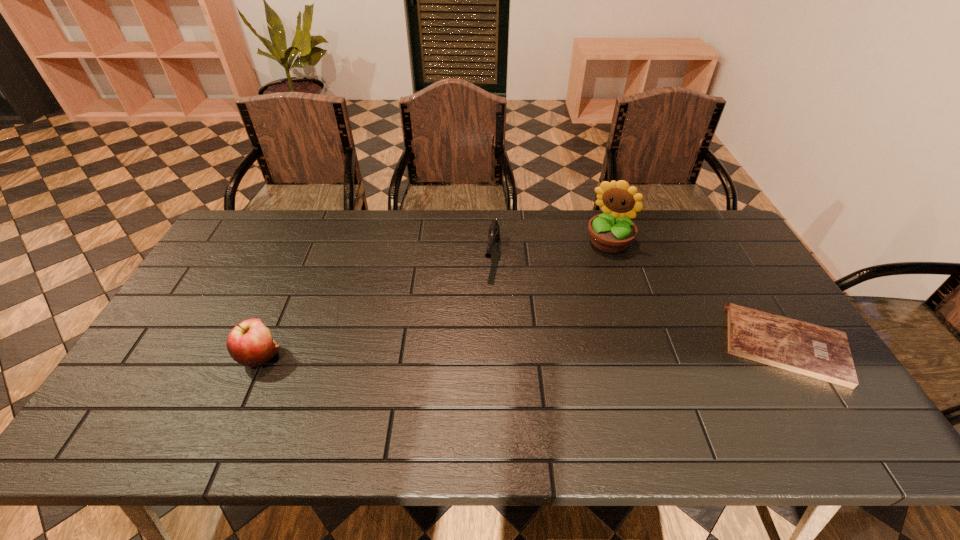
The image size is (960, 540). I want to click on vacant space that is in between the third object from left to right and the second object from left to right, so click(x=551, y=249).

I want to click on vacant region between the third object from left to right and the rightmost object, so click(697, 294).

You are a GUI agent. You are given a task and a screenshot of the screen. Output one action in this format:
    pyautogui.click(x=<x>, y=<y>)
    Task: Click on the vacant area between the tallest object and the gun
    Image resolution: width=960 pixels, height=540 pixels.
    Given the screenshot: What is the action you would take?
    pyautogui.click(x=551, y=249)

The height and width of the screenshot is (540, 960). Identify the location of vacant area that lies between the tallest object and the Bible. (697, 294).

The height and width of the screenshot is (540, 960). What are the coordinates of `vacant space that's between the sunflower and the leftmost object` in the screenshot? It's located at pos(435,299).

At what (x,y) coordinates should I click in order to perform the action: click on free spot between the Bible and the gun. Please return your answer as a coordinate pair (x, y). This screenshot has width=960, height=540. Looking at the image, I should click on (639, 301).

Where is `object identified as the closest to the apple`? The image size is (960, 540). object identified as the closest to the apple is located at coordinates (494, 231).

Identify which object is the third nearest to the leftmost object. Please provide its 2D coordinates. Your answer should be formatted as a tuple, i.e. [(x, y)], where the tuple contains the x and y coordinates of a point satisfying the conditions above.

[(815, 351)]

Locate an element on the screen. The height and width of the screenshot is (540, 960). free space in the image that satisfies the following two spatial constraints: 1. on the front side of the shortest object; 2. on the right side of the gun is located at coordinates (495, 346).

This screenshot has height=540, width=960. What are the coordinates of `free space that satisfies the following two spatial constraints: 1. on the front side of the third object from left to right; 2. on the left side of the shortest object` in the screenshot? It's located at (x=643, y=346).